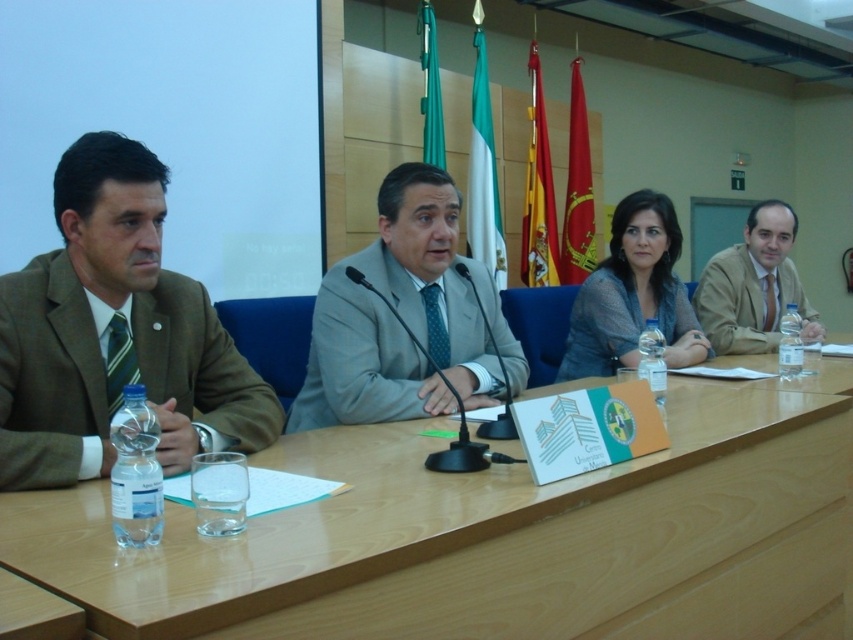
Question: Which of the following is the farthest from the observer?

Choices:
 (A) gray textured sweater at center
 (B) brown woolen suit at left
 (C) light brown fabric suit at right
 (D) light gray fabric suit at center

Answer: (C)

Question: Does wooden table at center have a smaller size compared to light brown fabric suit at right?

Choices:
 (A) no
 (B) yes

Answer: (A)

Question: Which point appears farthest from the camera in this image?

Choices:
 (A) (407, 284)
 (B) (137, 317)
 (C) (436, 445)

Answer: (A)

Question: Can you confirm if wooden table at center is positioned above light gray fabric suit at center?

Choices:
 (A) yes
 (B) no

Answer: (B)

Question: Is light gray fabric suit at center above light brown fabric suit at right?

Choices:
 (A) yes
 (B) no

Answer: (B)

Question: Which object appears closest to the camera in this image?

Choices:
 (A) light gray fabric suit at center
 (B) light brown fabric suit at right

Answer: (A)